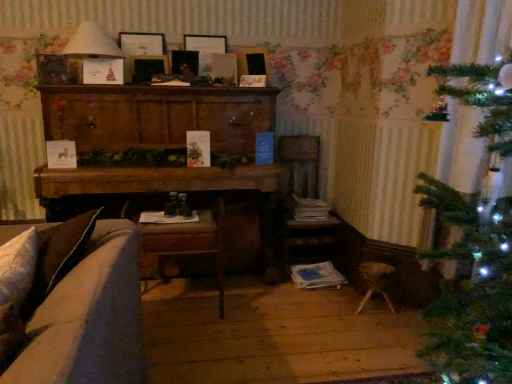
Find the location of a particular element. Image resolution: width=512 pixels, height=384 pixels. free point behind woodenchair at lower center is located at coordinates (189, 284).